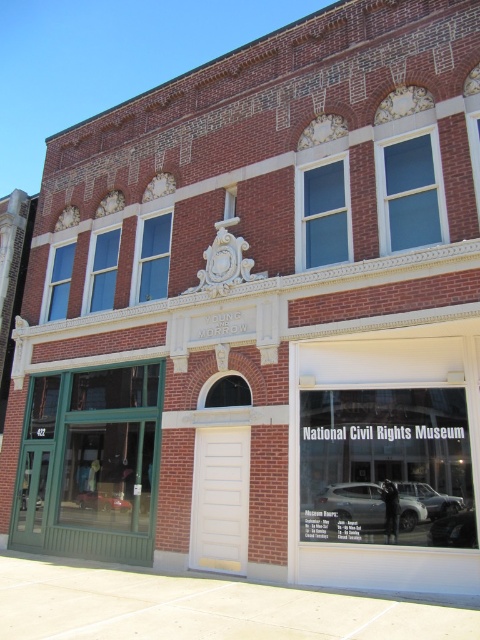
You are a delivery person needing to park your vehicle in front of the building. You see a metallic silver car at lower right and a satin silver suv at lower right. Which vehicle is closer to the curb on the right side?

The metallic silver car at lower right is positioned on the right side of the satin silver suv at lower right, so it is closer to the curb on the right side.

You are a delivery person trying to park your metallic silver car at lower right. There is a satin silver suv at lower right already parked. Can you park your car without moving the suv?

The metallic silver car at lower right is below the satin silver suv at lower right, so you can park your car there without moving the suv since it is positioned lower.